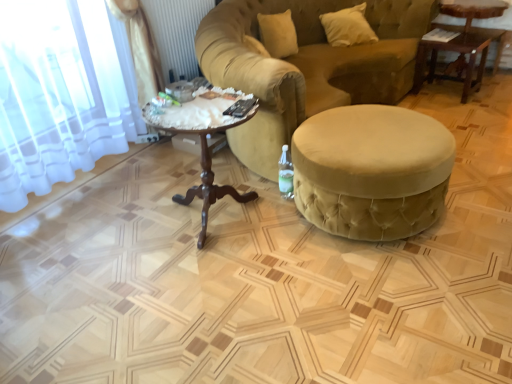
Locate an element on the screen. vacant area situated below mahogany wood coffee table at center (from a real-world perspective) is located at coordinates (217, 221).